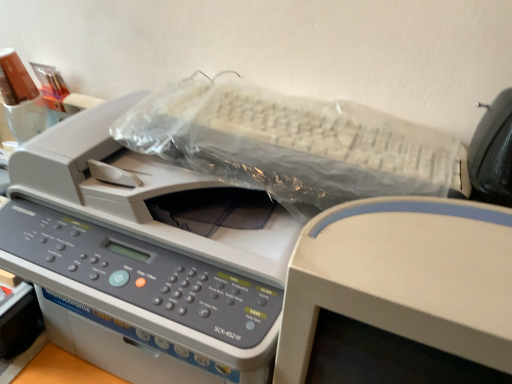
This screenshot has height=384, width=512. Find the location of `white plastic monitor at upper center`. white plastic monitor at upper center is located at coordinates (404, 278).

Image resolution: width=512 pixels, height=384 pixels. What do you see at coordinates (404, 278) in the screenshot?
I see `white plastic monitor at upper center` at bounding box center [404, 278].

In order to face white plastic printer at center, should I rotate leftwards or rightwards?

Rotate left and turn 10.739 degrees.

Where is `white plastic printer at center`? This screenshot has width=512, height=384. white plastic printer at center is located at coordinates (140, 260).

Image resolution: width=512 pixels, height=384 pixels. What do you see at coordinates (140, 260) in the screenshot? I see `white plastic printer at center` at bounding box center [140, 260].

In order to click on white plastic monitor at upper center in this screenshot , I will do `click(404, 278)`.

Considering the positions of objects white plastic printer at center and white plastic monitor at upper center in the image provided, who is more to the left, white plastic printer at center or white plastic monitor at upper center?

white plastic printer at center is more to the left.

Who is more distant, white plastic printer at center or white plastic monitor at upper center?

white plastic printer at center is behind.

Is point (133, 302) closer or farther from the camera than point (282, 356)?

Point (133, 302) is farther from the camera than point (282, 356).

From the image's perspective, is white plastic printer at center located above or below white plastic monitor at upper center?

white plastic printer at center is situated higher than white plastic monitor at upper center in the image.

From a real-world perspective, is white plastic printer at center physically located above or below white plastic monitor at upper center?

white plastic printer at center is below white plastic monitor at upper center.

Considering the relative sizes of white plastic printer at center and white plastic monitor at upper center in the image provided, is white plastic printer at center wider than white plastic monitor at upper center?

Correct, the width of white plastic printer at center exceeds that of white plastic monitor at upper center.

From their relative heights in the image, would you say white plastic printer at center is taller or shorter than white plastic monitor at upper center?

Clearly, white plastic printer at center is shorter compared to white plastic monitor at upper center.

In terms of size, does white plastic printer at center appear bigger or smaller than white plastic monitor at upper center?

white plastic printer at center is bigger than white plastic monitor at upper center.

Does white plastic printer at center contain white plastic monitor at upper center?

No.

Is white plastic printer at center beside white plastic monitor at upper center?

white plastic printer at center and white plastic monitor at upper center are not in contact.

Based on the photo, is white plastic printer at center facing towards white plastic monitor at upper center?

No, white plastic printer at center does not turn towards white plastic monitor at upper center.

Can you tell me how much white plastic printer at center and white plastic monitor at upper center differ in facing direction?

The facing directions of white plastic printer at center and white plastic monitor at upper center are 1.66 degrees apart.

Identify the location of office supplies on the right of white plastic printer at center. (404, 278).

Which is more to the left, white plastic monitor at upper center or white plastic printer at center?

white plastic printer at center.

Is white plastic monitor at upper center positioned before white plastic printer at center?

Yes, it is.

Does point (397, 205) appear closer or farther from the camera than point (82, 112)?

Clearly, point (397, 205) is closer to the camera than point (82, 112).

From the image's perspective, does white plastic monitor at upper center appear lower than white plastic printer at center?

Correct, white plastic monitor at upper center appears lower than white plastic printer at center in the image.

Looking at this image, from a real-world perspective, which object rests below the other?

white plastic printer at center.

Which object is wider, white plastic monitor at upper center or white plastic printer at center?

With larger width is white plastic printer at center.

Considering the sizes of objects white plastic monitor at upper center and white plastic printer at center in the image provided, who is shorter, white plastic monitor at upper center or white plastic printer at center?

With less height is white plastic printer at center.

From the picture: Based on their sizes in the image, would you say white plastic monitor at upper center is bigger or smaller than white plastic printer at center?

Clearly, white plastic monitor at upper center is smaller in size than white plastic printer at center.

Is white plastic monitor at upper center positioned beyond the bounds of white plastic printer at center?

white plastic monitor at upper center lies outside white plastic printer at center's area.

Is white plastic monitor at upper center in contact with white plastic printer at center?

No, white plastic monitor at upper center is not touching white plastic printer at center.

Does white plastic monitor at upper center turn towards white plastic printer at center?

No, white plastic monitor at upper center does not turn towards white plastic printer at center.

In the scene shown: How many degrees apart are the facing directions of white plastic monitor at upper center and white plastic printer at center?

The angle between the facing direction of white plastic monitor at upper center and the facing direction of white plastic printer at center is 1.66 degrees.

Find the location of a particular element. The height and width of the screenshot is (384, 512). office supplies in front of the white plastic printer at center is located at coordinates (404, 278).

Locate an element on the screen. office supplies on the right of white plastic printer at center is located at coordinates (404, 278).

Identify the location of office supplies that is in front of the white plastic printer at center. (404, 278).